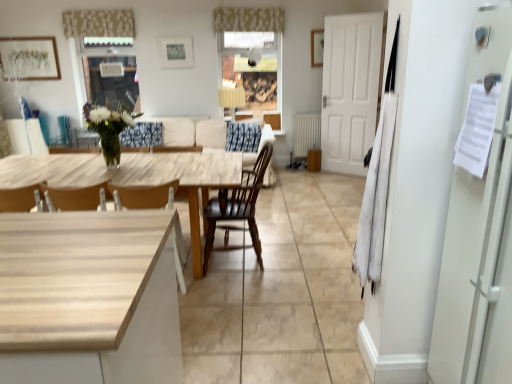
Question: Would you consider wooden chair at center, the second chair from the right, to be distant from beige floral fabric valance at upper center, which appears as the first curtain when viewed from the right?

Choices:
 (A) yes
 (B) no

Answer: (A)

Question: Considering the relative sizes of wooden chair at center, the 1th chair viewed from the left, and beige floral fabric valance at upper center, which appears as the first curtain when viewed from the right, in the image provided, is wooden chair at center, the 1th chair viewed from the left, wider than beige floral fabric valance at upper center, which appears as the first curtain when viewed from the right,?

Choices:
 (A) no
 (B) yes

Answer: (B)

Question: Is wooden chair at center, the 1th chair viewed from the left, oriented away from beige floral fabric valance at upper center, which appears as the first curtain when viewed from the right?

Choices:
 (A) no
 (B) yes

Answer: (A)

Question: Can you confirm if wooden chair at center, the 1th chair viewed from the left, is bigger than beige floral fabric valance at upper center, which appears as the first curtain when viewed from the right?

Choices:
 (A) no
 (B) yes

Answer: (B)

Question: Is wooden chair at center, the second chair from the right, at the right side of beige floral fabric valance at upper center, which appears as the first curtain when viewed from the right?

Choices:
 (A) no
 (B) yes

Answer: (A)

Question: Is light wood table at center taller or shorter than metallic silver picture frame at upper center, which is counted as the 2th picture frame, starting from the left?

Choices:
 (A) short
 (B) tall

Answer: (B)

Question: Is light wood table at center bigger or smaller than metallic silver picture frame at upper center, positioned as the 2th picture frame in right-to-left order?

Choices:
 (A) small
 (B) big

Answer: (B)

Question: In the image, is light wood table at center on the left side or the right side of metallic silver picture frame at upper center, positioned as the 2th picture frame in right-to-left order?

Choices:
 (A) right
 (B) left

Answer: (B)

Question: Is light wood table at center inside the boundaries of metallic silver picture frame at upper center, positioned as the 2th picture frame in right-to-left order, or outside?

Choices:
 (A) outside
 (B) inside

Answer: (A)

Question: From a real-world perspective, is dark brown wood chair at center, positioned as the second chair in left-to-right order, positioned above or below matte wood cabinet at center?

Choices:
 (A) above
 (B) below

Answer: (B)

Question: In terms of size, does dark brown wood chair at center, which is counted as the first chair, starting from the right, appear bigger or smaller than matte wood cabinet at center?

Choices:
 (A) big
 (B) small

Answer: (A)

Question: In terms of width, does dark brown wood chair at center, which is counted as the first chair, starting from the right, look wider or thinner when compared to matte wood cabinet at center?

Choices:
 (A) thin
 (B) wide

Answer: (B)

Question: In terms of height, does dark brown wood chair at center, which is counted as the first chair, starting from the right, look taller or shorter compared to matte wood cabinet at center?

Choices:
 (A) tall
 (B) short

Answer: (A)

Question: Is light wood table at center inside or outside of beige textured curtain at upper center, which is the 1th curtain from left to right?

Choices:
 (A) inside
 (B) outside

Answer: (B)

Question: Considering the relative positions of light wood table at center and beige textured curtain at upper center, which is the 1th curtain from left to right, in the image provided, is light wood table at center to the left or to the right of beige textured curtain at upper center, which is the 1th curtain from left to right,?

Choices:
 (A) left
 (B) right

Answer: (B)